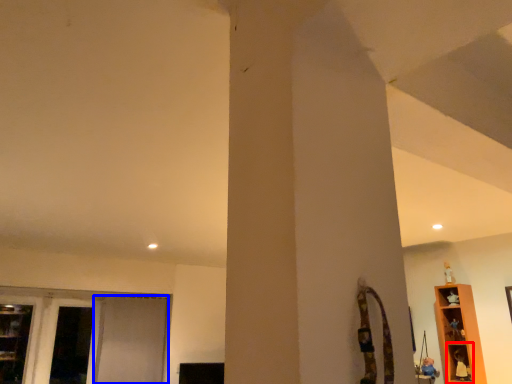
Question: Which point is further to the camera, shelf (highlighted by a red box) or screen door (highlighted by a blue box)?

Choices:
 (A) shelf
 (B) screen door

Answer: (B)